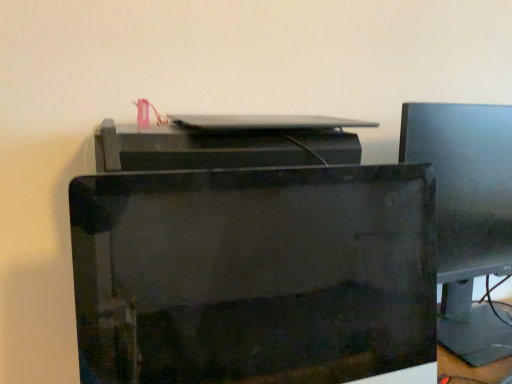
Question: Considering the positions of point (494, 226) and point (234, 117), is point (494, 226) closer or farther from the camera than point (234, 117)?

Choices:
 (A) farther
 (B) closer

Answer: (A)

Question: Considering their positions, is matte black monitor at right located in front of or behind satin silver laptop at center?

Choices:
 (A) behind
 (B) front

Answer: (A)

Question: Based on their relative distances, which object is farther from the satin silver laptop at center?

Choices:
 (A) matte black monitor at right
 (B) glossy black printer at center

Answer: (A)

Question: Which object is the closest to the glossy black printer at center?

Choices:
 (A) satin silver laptop at center
 (B) matte black monitor at right

Answer: (A)